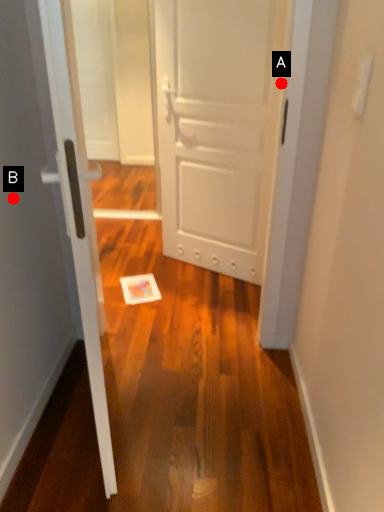
Question: Two points are circled on the image, labeled by A and B beside each circle. Which point is farther to the camera?

Choices:
 (A) A is further
 (B) B is further

Answer: (A)